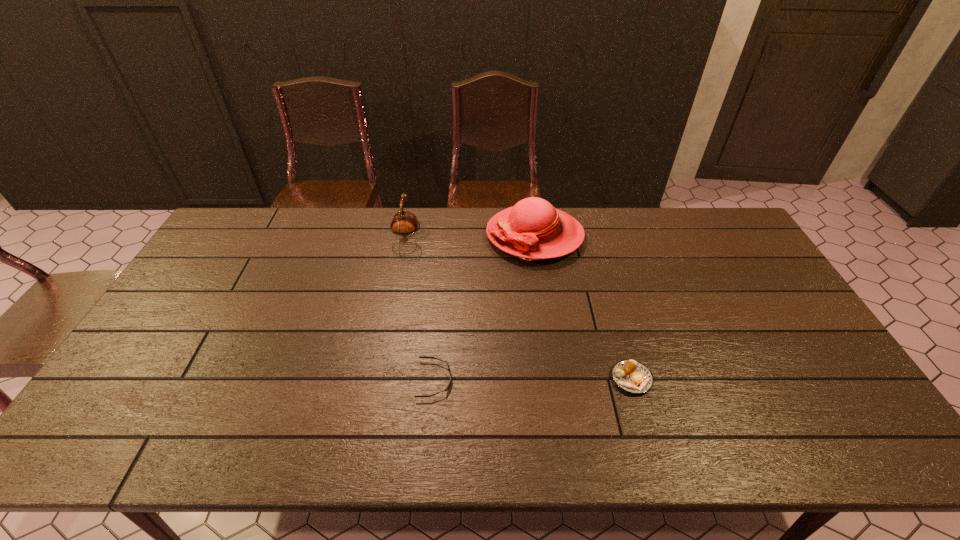
Locate an element on the screen. The height and width of the screenshot is (540, 960). vacant space situated 0.050m on the back of the third tallest object is located at coordinates (622, 347).

Locate an element on the screen. Image resolution: width=960 pixels, height=540 pixels. vacant space located on the front-facing side of the sunglasses is located at coordinates (526, 380).

Locate an element on the screen. hat situated at the far edge is located at coordinates click(533, 229).

Locate an element on the screen. This screenshot has height=540, width=960. telephone that is at the far edge is located at coordinates (403, 222).

Find the location of a particular element. The image size is (960, 540). free location at the far edge of the desktop is located at coordinates (655, 211).

Where is `free region at the near edge of the desktop`? free region at the near edge of the desktop is located at coordinates (642, 441).

The width and height of the screenshot is (960, 540). Find the location of `free space at the left edge of the desktop`. free space at the left edge of the desktop is located at coordinates (130, 416).

Where is `vacant position at the right edge of the desktop`? vacant position at the right edge of the desktop is located at coordinates (772, 361).

At what (x,y) coordinates should I click in order to perform the action: click on free space between the second shortest object and the third shortest object. Please return your answer as a coordinate pair (x, y). Image resolution: width=960 pixels, height=540 pixels. Looking at the image, I should click on (520, 308).

Locate an element on the screen. This screenshot has height=540, width=960. free space between the third object from right to left and the second tallest object is located at coordinates (421, 308).